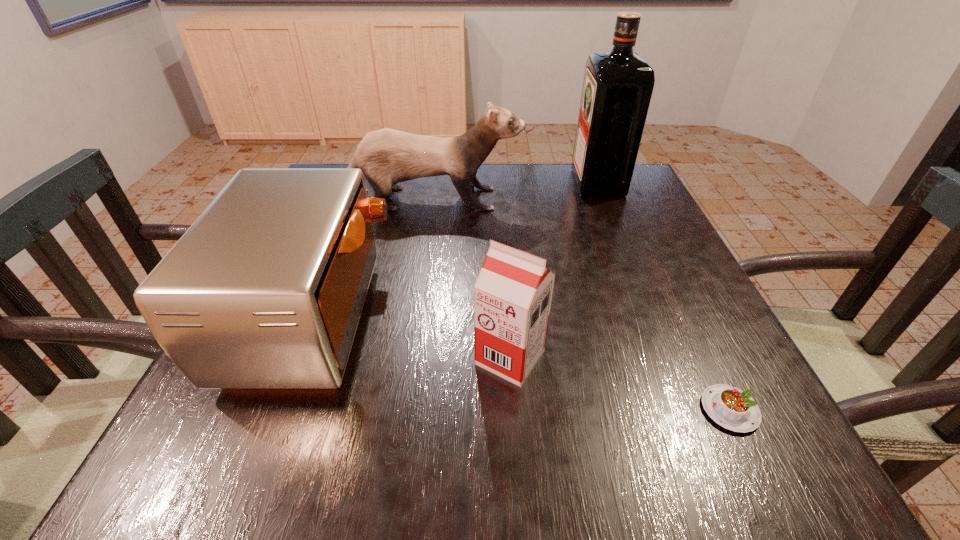
Locate an element on the screen. The width and height of the screenshot is (960, 540). vacant region that satisfies the following two spatial constraints: 1. on the face of the pudding; 2. on the left side of the ferret is located at coordinates (371, 410).

Locate an element on the screen. This screenshot has width=960, height=540. vacant space that satisfies the following two spatial constraints: 1. on the face of the soya milk; 2. on the right side of the ferret is located at coordinates (382, 357).

Where is `free point that satisfies the following two spatial constraints: 1. on the door side of the toaster oven; 2. on the left side of the soya milk`? This screenshot has width=960, height=540. free point that satisfies the following two spatial constraints: 1. on the door side of the toaster oven; 2. on the left side of the soya milk is located at coordinates (300, 357).

The width and height of the screenshot is (960, 540). I want to click on vacant space that satisfies the following two spatial constraints: 1. on the door side of the soya milk; 2. on the right side of the toaster oven, so click(300, 357).

Locate an element on the screen. The height and width of the screenshot is (540, 960). vacant region that satisfies the following two spatial constraints: 1. on the door side of the toaster oven; 2. on the left side of the shortest object is located at coordinates (279, 410).

You are a GUI agent. You are given a task and a screenshot of the screen. Output one action in this format:
    pyautogui.click(x=<x>, y=<y>)
    Task: Click on the free point that satisfies the following two spatial constraints: 1. on the door side of the toaster oven; 2. on the back side of the shortest object
    This screenshot has height=540, width=960.
    Given the screenshot: What is the action you would take?
    pyautogui.click(x=279, y=410)